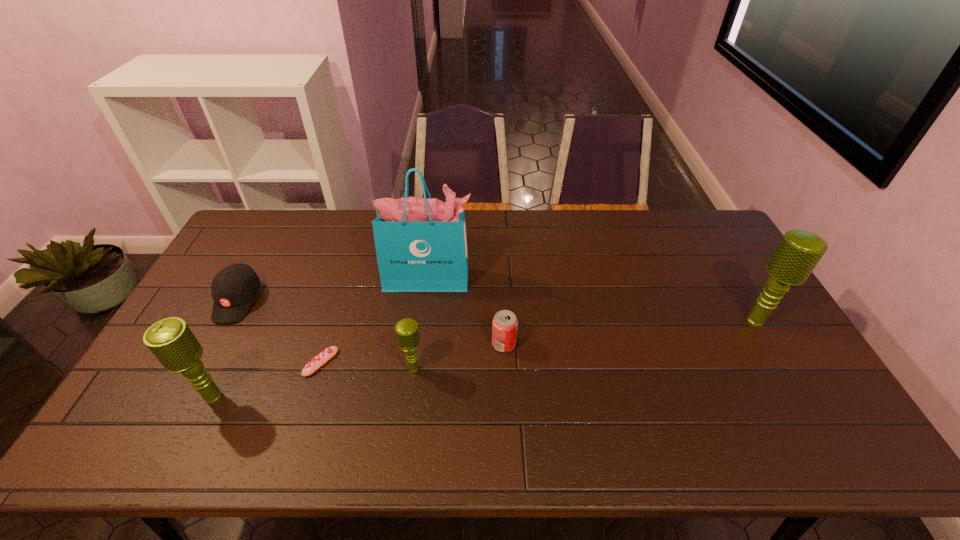
Locate an element on the screen. vacant area that lies between the shopping bag and the soda can is located at coordinates (467, 312).

Identify the location of vacant area that lies between the fourth shortest object and the rightmost microphone. The image size is (960, 540). (585, 346).

Find the location of a particular element. Image resolution: width=960 pixels, height=540 pixels. vacant space that's between the rightmost object and the tallest object is located at coordinates (592, 300).

You are a GUI agent. You are given a task and a screenshot of the screen. Output one action in this format:
    pyautogui.click(x=<x>, y=<y>)
    Task: Click on the free space between the soda can and the tallest object
    The width and height of the screenshot is (960, 540).
    Given the screenshot: What is the action you would take?
    pyautogui.click(x=467, y=312)

Find the location of a particular element. The height and width of the screenshot is (540, 960). vacant area that lies between the baseball cap and the second shortest microphone is located at coordinates (226, 349).

This screenshot has height=540, width=960. Identify the location of vacant region between the baseball cap and the shopping bag. (333, 290).

Identify the location of object that can be found as the sixth closest to the nearest object. Image resolution: width=960 pixels, height=540 pixels. (798, 253).

Locate an element on the screen. object identified as the fourth closest to the second nearest microphone is located at coordinates (171, 341).

This screenshot has height=540, width=960. Identify the location of microphone that stands as the closest to the fourth shortest object. (171, 341).

Select which microphone appears as the second closest to the shopping bag. Please provide its 2D coordinates. Your answer should be formatted as a tuple, i.e. [(x, y)], where the tuple contains the x and y coordinates of a point satisfying the conditions above.

[(171, 341)]